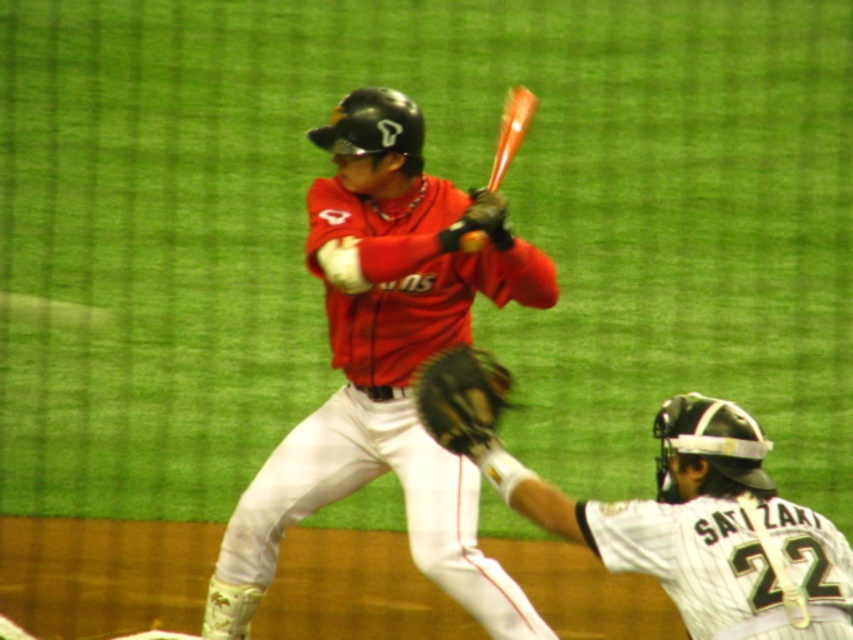
You are a photographer trying to capture the batter and catcher during the game. Since the batter is wearing the matte red jersey at center and the catcher is in the white textured uniform at center, which one is closer to the camera?

The matte red jersey at center is closer to the camera because the white textured uniform at center is behind it.

You are a spectator at the baseball game and want to know which object is lower in the image. The objects are the matte red jersey at center and the shiny orange baseball at center. Which one is lower?

The matte red jersey at center is positioned under the shiny orange baseball at center, so the matte red jersey at center is lower in the image.